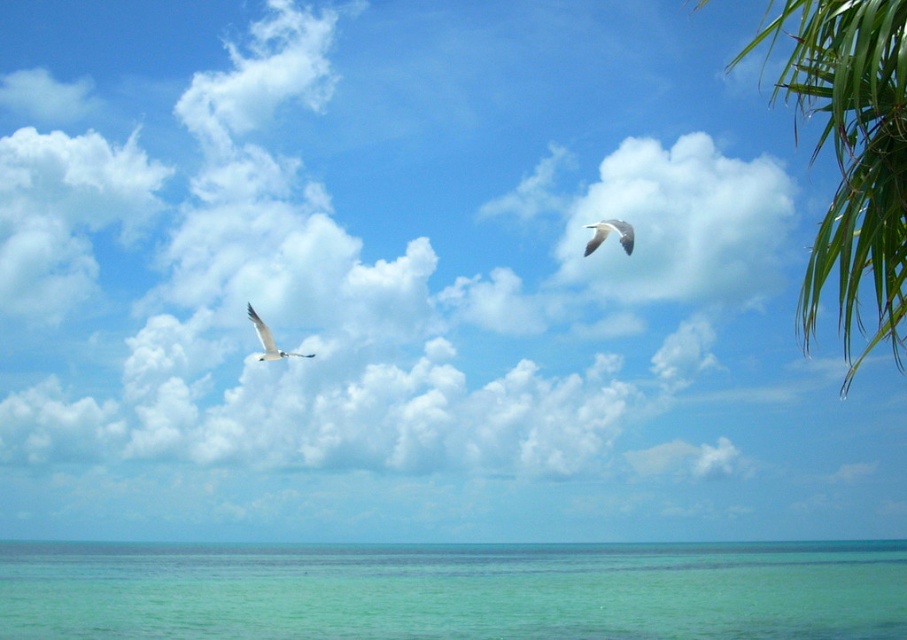
Question: Which object is the farthest from the white glossy bird at upper left?

Choices:
 (A) white matte bird at upper right
 (B) clear water at lower center

Answer: (B)

Question: Which of the following is the farthest from the observer?

Choices:
 (A) clear water at lower center
 (B) white matte bird at upper right
 (C) white glossy bird at upper left
 (D) green leafy palm tree at upper right

Answer: (A)

Question: Which object is positioned closest to the white matte bird at upper right?

Choices:
 (A) green leafy palm tree at upper right
 (B) white glossy bird at upper left

Answer: (B)

Question: Is clear water at lower center wider than white matte bird at upper right?

Choices:
 (A) yes
 (B) no

Answer: (A)

Question: Is green leafy palm tree at upper right closer to camera compared to white matte bird at upper right?

Choices:
 (A) yes
 (B) no

Answer: (A)

Question: Is green leafy palm tree at upper right to the right of white matte bird at upper right from the viewer's perspective?

Choices:
 (A) yes
 (B) no

Answer: (A)